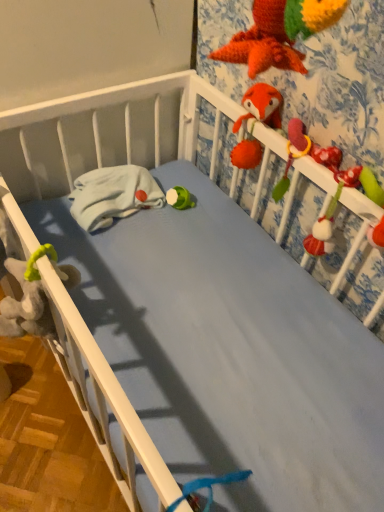
Question: Should I look upward or downward to see white matte crib rail at center?

Choices:
 (A) up
 (B) down

Answer: (B)

Question: Can you confirm if soft plush toy at right, the 2th toy when ordered from top to bottom, is bigger than fuzzy red parrot at upper right?

Choices:
 (A) no
 (B) yes

Answer: (B)

Question: Considering the relative positions of soft plush toy at right, which is the first toy in right-to-left order, and fuzzy red parrot at upper right in the image provided, is soft plush toy at right, which is the first toy in right-to-left order, to the right of fuzzy red parrot at upper right from the viewer's perspective?

Choices:
 (A) no
 (B) yes

Answer: (B)

Question: From a real-world perspective, is soft plush toy at right, the second toy viewed from the left, physically below fuzzy red parrot at upper right?

Choices:
 (A) no
 (B) yes

Answer: (B)

Question: From a real-world perspective, is soft plush toy at right, the second toy viewed from the left, physically above fuzzy red parrot at upper right?

Choices:
 (A) no
 (B) yes

Answer: (A)

Question: Can you confirm if soft plush toy at right, the 2th toy when ordered from top to bottom, is thinner than fuzzy red parrot at upper right?

Choices:
 (A) yes
 (B) no

Answer: (B)

Question: Is fuzzy red parrot at upper right at the back of soft plush toy at right, which is the first toy in right-to-left order?

Choices:
 (A) yes
 (B) no

Answer: (B)

Question: Is white matte crib rail at center beside soft plush toy at right, acting as the 1th toy starting from the bottom?

Choices:
 (A) yes
 (B) no

Answer: (B)

Question: Is white matte crib rail at center at the left side of soft plush toy at right, which is the first toy in right-to-left order?

Choices:
 (A) no
 (B) yes

Answer: (B)

Question: Considering the relative sizes of white matte crib rail at center and soft plush toy at right, which is the first toy in right-to-left order, in the image provided, is white matte crib rail at center thinner than soft plush toy at right, which is the first toy in right-to-left order,?

Choices:
 (A) yes
 (B) no

Answer: (B)

Question: Can you confirm if white matte crib rail at center is shorter than soft plush toy at right, the second toy viewed from the left?

Choices:
 (A) no
 (B) yes

Answer: (B)

Question: Is white matte crib rail at center looking in the opposite direction of soft plush toy at right, the 2th toy when ordered from top to bottom?

Choices:
 (A) yes
 (B) no

Answer: (B)

Question: Is white matte crib rail at center outside of soft plush toy at right, acting as the 1th toy starting from the bottom?

Choices:
 (A) no
 (B) yes

Answer: (B)

Question: Is fluffy orange fox at upper right, which appears as the 1th toy when viewed from the top, outside of soft plush toy at right, acting as the 1th toy starting from the bottom?

Choices:
 (A) no
 (B) yes

Answer: (B)